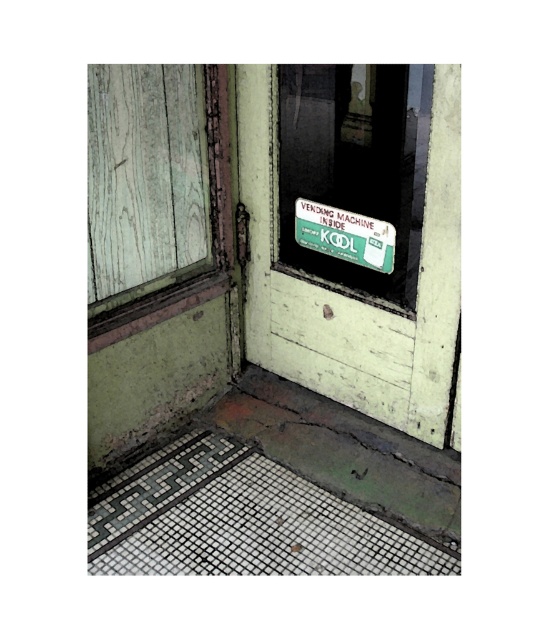
Measure the distance from weathered wood window at upper left to green matte vending machine at upper center.

weathered wood window at upper left and green matte vending machine at upper center are 15.73 inches apart from each other.

Can you confirm if weathered wood window at upper left is smaller than green matte vending machine at upper center?

Actually, weathered wood window at upper left might be larger than green matte vending machine at upper center.

Between point (210, 115) and point (391, 237), which one is positioned in front?

Point (391, 237) is in front.

At what (x,y) coordinates should I click in order to perform the action: click on weathered wood window at upper left. Please return your answer as a coordinate pair (x, y). Looking at the image, I should click on (156, 195).

Can you confirm if green matte screen door at center is positioned to the right of green matte vending machine at upper center?

Incorrect, green matte screen door at center is not on the right side of green matte vending machine at upper center.

Does green matte screen door at center have a larger size compared to green matte vending machine at upper center?

Yes, green matte screen door at center is bigger than green matte vending machine at upper center.

I want to click on green matte screen door at center, so click(x=355, y=234).

Between point (430, 234) and point (312, 275), which one is positioned behind?

Positioned behind is point (312, 275).

Image resolution: width=549 pixels, height=640 pixels. Describe the element at coordinates (355, 234) in the screenshot. I see `green matte screen door at center` at that location.

At what (x,y) coordinates should I click in order to perform the action: click on green matte screen door at center. Please return your answer as a coordinate pair (x, y). Looking at the image, I should click on (355, 234).